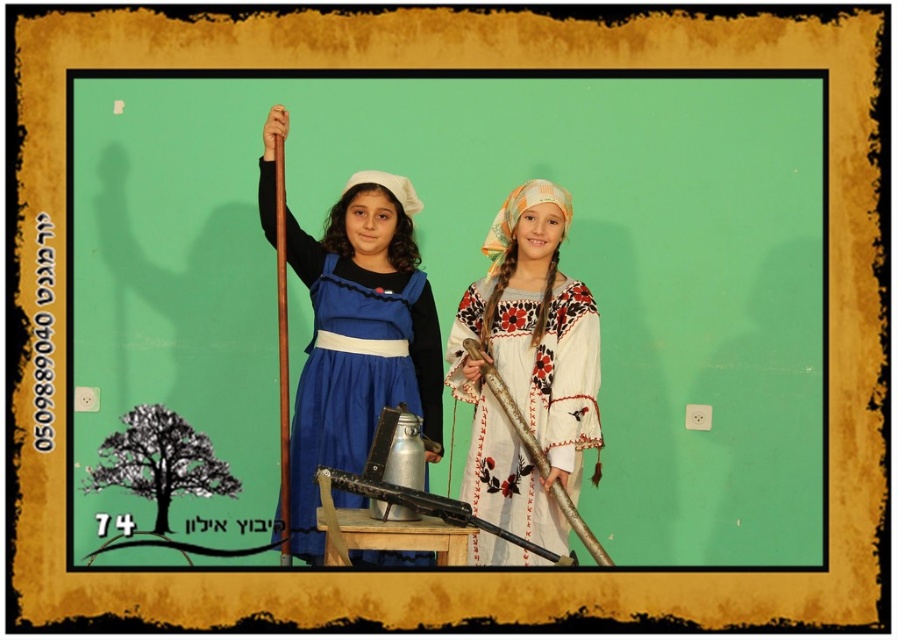
Is point (266, 125) in front of point (551, 253)?

Yes, it is in front of point (551, 253).

Based on the photo, is matte blue dress at center closer to the viewer compared to white embroidered dress at center?

That is True.

Is point (358, 248) farther from viewer compared to point (530, 289)?

Yes, point (358, 248) is behind point (530, 289).

Find the location of a particular element. The height and width of the screenshot is (640, 898). matte blue dress at center is located at coordinates (359, 337).

Is the position of green matte wall at center more distant than that of white embroidered dress at center?

Yes.

Is green matte wall at center bigger than white embroidered dress at center?

Yes.

Is point (200, 106) behind point (515, 225)?

Yes, point (200, 106) is behind point (515, 225).

The width and height of the screenshot is (898, 640). What are the coordinates of `green matte wall at center` in the screenshot? It's located at (481, 275).

From the picture: Which is more to the right, green matte wall at center or matte blue dress at center?

From the viewer's perspective, green matte wall at center appears more on the right side.

Between point (117, 310) and point (401, 369), which one is positioned behind?

Point (117, 310)

Is point (169, 268) more distant than point (324, 362)?

That is True.

Where is `green matte wall at center`? green matte wall at center is located at coordinates (481, 275).